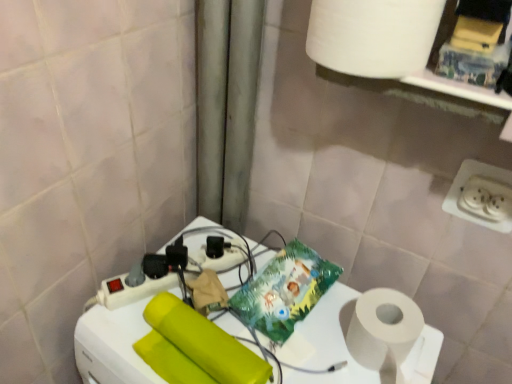
Describe the element at coordinates (481, 195) in the screenshot. I see `white plastic power plugs and sockets at lower right` at that location.

The height and width of the screenshot is (384, 512). I want to click on white plastic power plugs and sockets at lower right, so click(481, 195).

The height and width of the screenshot is (384, 512). What do you see at coordinates (205, 342) in the screenshot?
I see `matte yellow toilet paper at center` at bounding box center [205, 342].

Identify the location of white plastic power strip at center. (112, 345).

Measure the distance between point (x=110, y=352) and camera.

A distance of 29.17 inches exists between point (x=110, y=352) and camera.

Locate an element on the screen. This screenshot has height=384, width=512. white plastic power plugs and sockets at lower right is located at coordinates (481, 195).

Which of these two, white matte paper towel at upper right or white plastic power strip at center, stands taller?

With more height is white plastic power strip at center.

From the image's perspective, which is above, white matte paper towel at upper right or white plastic power strip at center?

white matte paper towel at upper right.

Does white matte paper towel at upper right come in front of white plastic power strip at center?

No, it is behind white plastic power strip at center.

How much distance is there between white matte paper towel at upper right and white plastic power strip at center?

white matte paper towel at upper right and white plastic power strip at center are 20.02 inches apart.

Is white plastic power strip at center shorter than white matte paper towel at upper right?

In fact, white plastic power strip at center may be taller than white matte paper towel at upper right.

In order to click on paper towel above the white plastic power strip at center (from the image's perspective) in this screenshot , I will do `click(373, 36)`.

Measure the distance between white plastic power strip at center and white matte paper towel at upper right.

white plastic power strip at center is 20.02 inches away from white matte paper towel at upper right.

From the picture: Can you confirm if white plastic power strip at center is positioned to the left of white matte paper towel at upper right?

Indeed, white plastic power strip at center is positioned on the left side of white matte paper towel at upper right.

Could you tell me if white plastic power plugs and sockets at lower right is turned towards white matte paper towel at upper right?

No.

Is white plastic power plugs and sockets at lower right smaller than white matte paper towel at upper right?

Yes.

Does white plastic power plugs and sockets at lower right have a lesser width compared to white matte paper towel at upper right?

Indeed, white plastic power plugs and sockets at lower right has a lesser width compared to white matte paper towel at upper right.

Consider the image. Is the position of white plastic power plugs and sockets at lower right more distant than that of white matte paper towel at upper right?

Yes, white plastic power plugs and sockets at lower right is behind white matte paper towel at upper right.

Is point (245, 380) positioned after point (508, 213)?

No, it is not.

Would you say matte yellow toilet paper at center is a long distance from white plastic power plugs and sockets at lower right?

matte yellow toilet paper at center is actually quite close to white plastic power plugs and sockets at lower right.

Which object is positioned more to the right, matte yellow toilet paper at center or white plastic power plugs and sockets at lower right?

From the viewer's perspective, white plastic power plugs and sockets at lower right appears more on the right side.

From a real-world perspective, is white matte paper towel at upper right positioned above or below matte yellow toilet paper at center?

white matte paper towel at upper right is situated higher than matte yellow toilet paper at center in the real world.

In terms of size, does white matte paper towel at upper right appear bigger or smaller than matte yellow toilet paper at center?

Clearly, white matte paper towel at upper right is larger in size than matte yellow toilet paper at center.

Is white matte paper towel at upper right not near matte yellow toilet paper at center?

No, white matte paper towel at upper right is in close proximity to matte yellow toilet paper at center.

Is white matte paper towel at upper right facing away from matte yellow toilet paper at center?

That's not correct — white matte paper towel at upper right is not looking away from matte yellow toilet paper at center.

Where is `appliance on the left of white plastic power plugs and sockets at lower right`? The width and height of the screenshot is (512, 384). appliance on the left of white plastic power plugs and sockets at lower right is located at coordinates (112, 345).

Is white plastic power strip at center inside white plastic power plugs and sockets at lower right?

That's incorrect, white plastic power strip at center is not inside white plastic power plugs and sockets at lower right.

Considering the sizes of white plastic power plugs and sockets at lower right and white plastic power strip at center in the image, is white plastic power plugs and sockets at lower right bigger or smaller than white plastic power strip at center?

Clearly, white plastic power plugs and sockets at lower right is smaller in size than white plastic power strip at center.

In the image, is white plastic power plugs and sockets at lower right on the left side or the right side of white plastic power strip at center?

Based on their positions, white plastic power plugs and sockets at lower right is located to the right of white plastic power strip at center.

Considering the points (99, 326) and (477, 197), which point is in front, point (99, 326) or point (477, 197)?

Positioned in front is point (99, 326).

Is white plastic power strip at center facing away from white plastic power plugs and sockets at lower right?

That's not correct — white plastic power strip at center is not looking away from white plastic power plugs and sockets at lower right.

This screenshot has height=384, width=512. I want to click on paper towel lying behind the white plastic power strip at center, so click(x=373, y=36).

Where is `paper towel above the white plastic power strip at center (from a real-world perspective)`? This screenshot has height=384, width=512. paper towel above the white plastic power strip at center (from a real-world perspective) is located at coordinates (373, 36).

Looking at this image, estimate the real-world distances between objects in this image. Which object is closer to matte yellow toilet paper at center, white matte paper towel at upper right or white plastic power plugs and sockets at lower right?

white matte paper towel at upper right is positioned closer to the anchor matte yellow toilet paper at center.

Estimate the real-world distances between objects in this image. Which object is further from white matte paper towel at upper right, white plastic power plugs and sockets at lower right or white plastic power strip at center?

Based on the image, white plastic power strip at center appears to be further to white matte paper towel at upper right.

Based on their spatial positions, is white matte paper towel at upper right or white plastic power strip at center further from matte yellow toilet paper at center?

white matte paper towel at upper right is further to matte yellow toilet paper at center.

Looking at this image, when comparing their distances from white plastic power plugs and sockets at lower right, does matte yellow toilet paper at center or white plastic power strip at center seem further?

matte yellow toilet paper at center.

When comparing their distances from white plastic power strip at center, does matte yellow toilet paper at center or white plastic power plugs and sockets at lower right seem further?

The object further to white plastic power strip at center is white plastic power plugs and sockets at lower right.

Based on their spatial positions, is white plastic power strip at center or white matte paper towel at upper right further from matte yellow toilet paper at center?

The object further to matte yellow toilet paper at center is white matte paper towel at upper right.

Which object lies further to the anchor point white matte paper towel at upper right, white plastic power strip at center or matte yellow toilet paper at center?

matte yellow toilet paper at center is further to white matte paper towel at upper right.

Estimate the real-world distances between objects in this image. Which object is further from white matte paper towel at upper right, matte yellow toilet paper at center or white plastic power plugs and sockets at lower right?

matte yellow toilet paper at center is positioned further to the anchor white matte paper towel at upper right.

Locate an element on the screen. This screenshot has height=384, width=512. power plugs and sockets between white matte paper towel at upper right and matte yellow toilet paper at center in the vertical direction is located at coordinates (481, 195).

Image resolution: width=512 pixels, height=384 pixels. In order to click on appliance between matte yellow toilet paper at center and white plastic power plugs and sockets at lower right in this screenshot , I will do `click(112, 345)`.

Where is `power plugs and sockets that lies between white matte paper towel at upper right and white plastic power strip at center from top to bottom`? power plugs and sockets that lies between white matte paper towel at upper right and white plastic power strip at center from top to bottom is located at coordinates (481, 195).

Find the location of a particular element. The image size is (512, 384). toilet paper between white matte paper towel at upper right and white plastic power strip at center vertically is located at coordinates (205, 342).